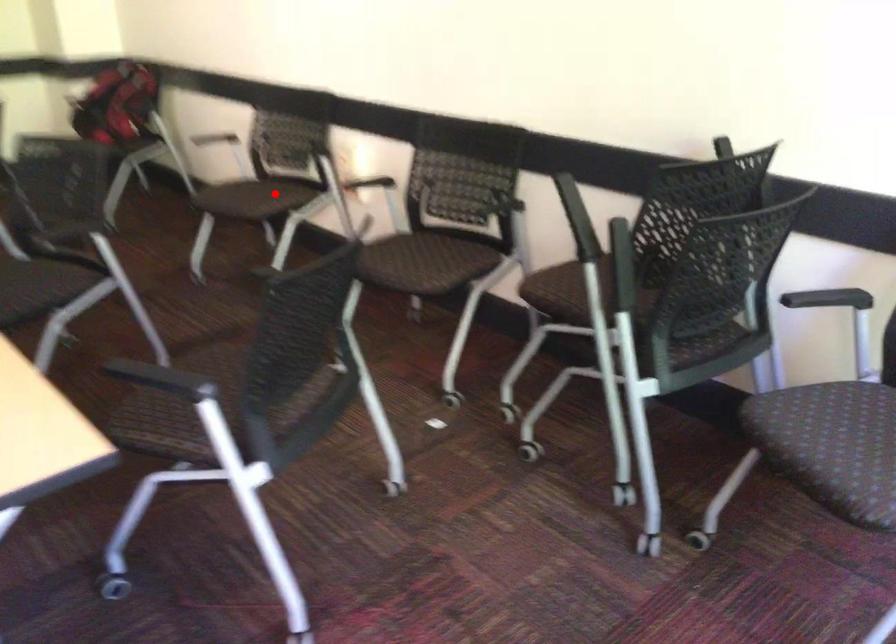
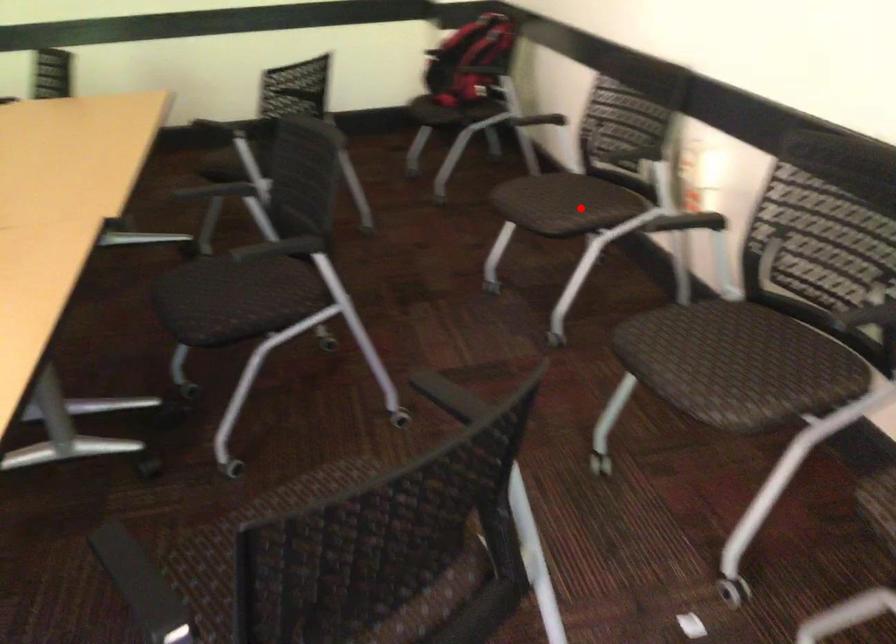
I am providing you with two images of the same scene from different viewpoints. A red point is marked on the first image and another point is marked on the second image. Is the marked point in image1 the same physical position as the marked point in image2?

Yes